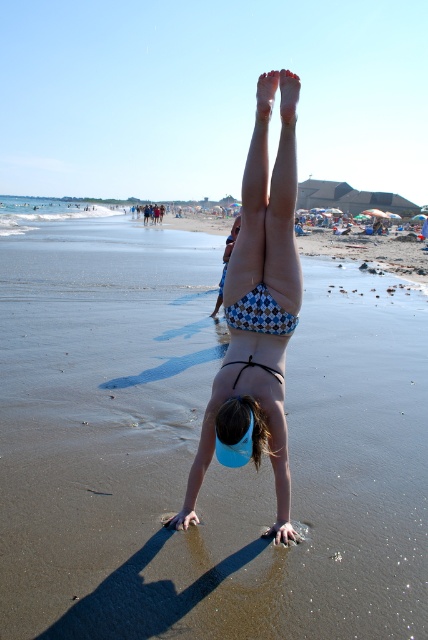
Locate an element on the screen. This screenshot has height=640, width=428. clear blue water at lower left is located at coordinates (45, 211).

Between point (59, 200) and point (225, 321), which one is positioned in front?

Point (225, 321) is in front.

What do you see at coordinates (45, 211) in the screenshot?
I see `clear blue water at lower left` at bounding box center [45, 211].

This screenshot has width=428, height=640. In order to click on clear blue water at lower left in this screenshot , I will do `click(45, 211)`.

From the picture: Does white checkered bikini at center appear on the left side of clear blue water at lower left?

No, white checkered bikini at center is not to the left of clear blue water at lower left.

Image resolution: width=428 pixels, height=640 pixels. What do you see at coordinates (258, 308) in the screenshot?
I see `white checkered bikini at center` at bounding box center [258, 308].

What are the coordinates of `white checkered bikini at center` in the screenshot? It's located at (258, 308).

Does brown sandy beach at center come behind blue checkered bikini top at center?

No.

Between brown sandy beach at center and blue checkered bikini top at center, which one appears on the left side from the viewer's perspective?

From the viewer's perspective, brown sandy beach at center appears more on the left side.

What do you see at coordinates (196, 445) in the screenshot?
I see `brown sandy beach at center` at bounding box center [196, 445].

Image resolution: width=428 pixels, height=640 pixels. What are the coordinates of `brown sandy beach at center` in the screenshot? It's located at (196, 445).